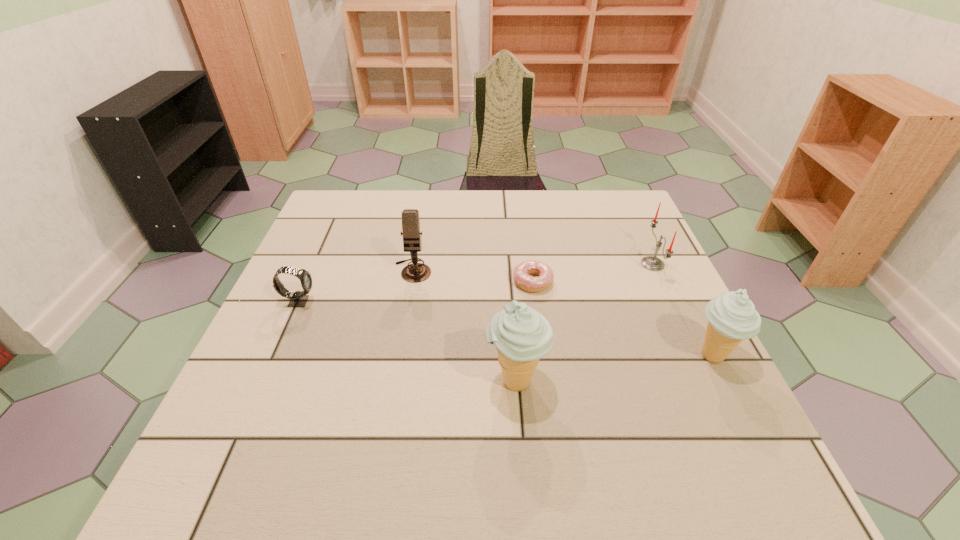
Please show where to add a icecream on the left while keeping spacing even. Please provide its 2D coordinates. Your answer should be formatted as a tuple, i.e. [(x, y)], where the tuple contains the x and y coordinates of a point satisfying the conditions above.

[(296, 409)]